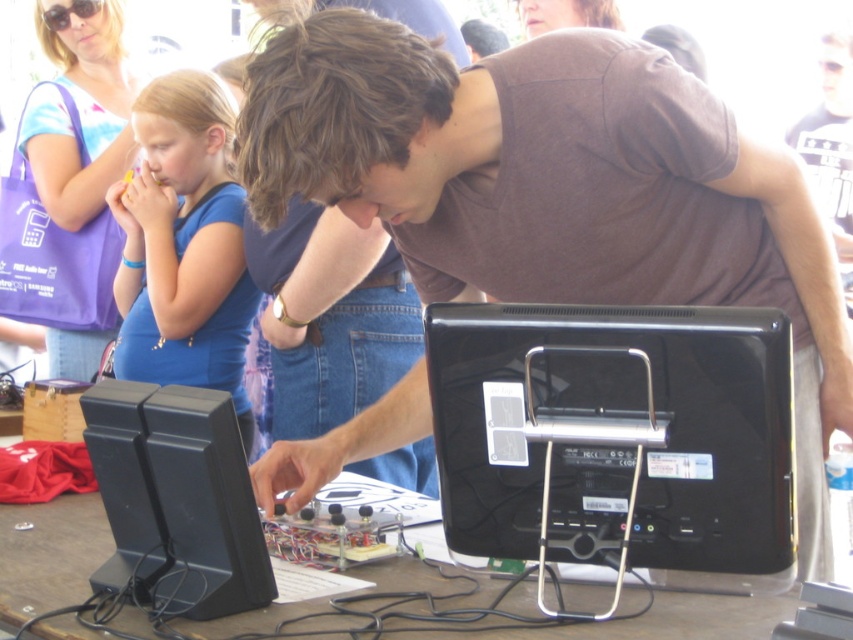
You are standing at the entrance of the exhibition hall and want to locate the person wearing the matte brown shirt at center. According to the coordinates provided, where should you look to find them?

The person wearing the matte brown shirt at center is located at coordinates point (556,189), so you should look towards the lower left area of the image.

You are standing in front of the table at the event. There are two points marked on the table surface. The first point is at coordinates point [792,310] and the second is at point [625,493]. If you were to place a small object on the table, which point would require you to reach closer to the edge of the table?

Point [792,310] is further to the viewer than point [625,493], so placing an object at point [792,310] would require reaching closer to the edge of the table.

You are a visitor at this event and want to see the black plastic monitor at center clearly. Since the matte brown shirt at center is blocking your view, can you walk around to the other side of the table to get a better look?

The black plastic monitor at center is behind matte brown shirt at center, so walking around to the other side of the table would allow you to see the black plastic monitor at center without obstruction.